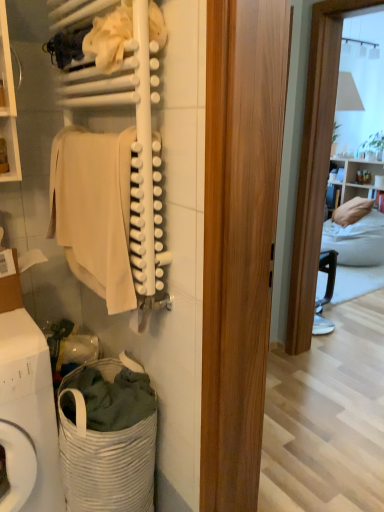
Question: Is white matte towel at upper left aimed at white woven laundry basket at lower left?

Choices:
 (A) no
 (B) yes

Answer: (A)

Question: Is white matte towel at upper left turned away from white woven laundry basket at lower left?

Choices:
 (A) yes
 (B) no

Answer: (B)

Question: From a real-world perspective, does white matte towel at upper left sit lower than white woven laundry basket at lower left?

Choices:
 (A) yes
 (B) no

Answer: (B)

Question: Is white matte towel at upper left placed right next to white woven laundry basket at lower left?

Choices:
 (A) no
 (B) yes

Answer: (A)

Question: Can you confirm if white matte towel at upper left is shorter than white woven laundry basket at lower left?

Choices:
 (A) no
 (B) yes

Answer: (A)

Question: Is white woven laundry basket at lower left in front of or behind beige cotton towel at left in the image?

Choices:
 (A) front
 (B) behind

Answer: (B)

Question: Is white woven laundry basket at lower left inside the boundaries of beige cotton towel at left, or outside?

Choices:
 (A) outside
 (B) inside

Answer: (A)

Question: Considering the positions of white woven laundry basket at lower left and beige cotton towel at left in the image, is white woven laundry basket at lower left bigger or smaller than beige cotton towel at left?

Choices:
 (A) big
 (B) small

Answer: (A)

Question: Would you say white woven laundry basket at lower left is to the left or to the right of beige cotton towel at left in the picture?

Choices:
 (A) right
 (B) left

Answer: (A)

Question: Based on their sizes in the image, would you say white woven laundry basket at lower left is bigger or smaller than beige cotton towel at left?

Choices:
 (A) small
 (B) big

Answer: (B)

Question: Would you say white woven laundry basket at lower left is to the left or to the right of beige cotton towel at left in the picture?

Choices:
 (A) left
 (B) right

Answer: (A)

Question: Is point (46, 451) closer or farther from the camera than point (125, 281)?

Choices:
 (A) closer
 (B) farther

Answer: (B)

Question: Considering the positions of white woven laundry basket at lower left and beige cotton towel at left in the image, is white woven laundry basket at lower left taller or shorter than beige cotton towel at left?

Choices:
 (A) short
 (B) tall

Answer: (B)

Question: Looking at the image, does white fabric at upper center seem bigger or smaller compared to white woven laundry basket at lower left?

Choices:
 (A) small
 (B) big

Answer: (A)

Question: Considering the positions of white fabric at upper center and white woven laundry basket at lower left in the image, is white fabric at upper center wider or thinner than white woven laundry basket at lower left?

Choices:
 (A) thin
 (B) wide

Answer: (A)